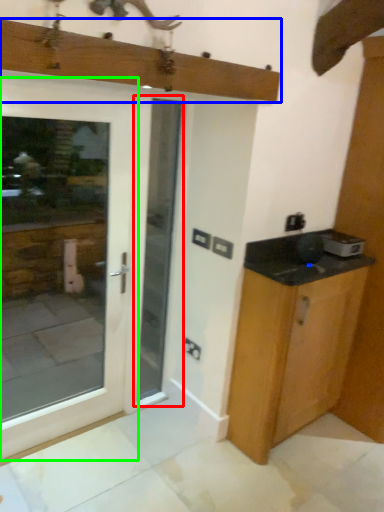
Question: Which is farther away from screen door (highlighted by a red box)? mantle (highlighted by a blue box) or door (highlighted by a green box)?

Choices:
 (A) mantle
 (B) door

Answer: (B)